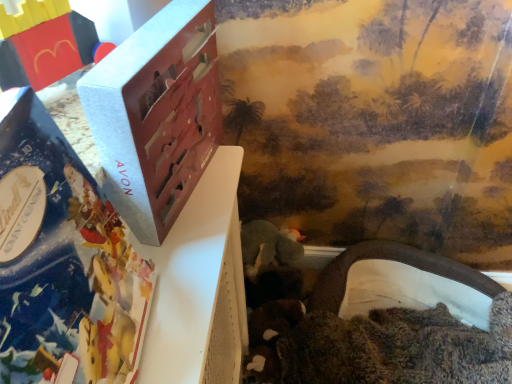
Question: Can you confirm if matte silver book at left is positioned to the left of white fabric tunnel at lower right, arranged as the 1th toy when ordered from the bottom?

Choices:
 (A) yes
 (B) no

Answer: (A)

Question: Considering the relative sizes of matte silver book at left and white fabric tunnel at lower right, arranged as the 1th toy when ordered from the bottom, in the image provided, is matte silver book at left bigger than white fabric tunnel at lower right, arranged as the 1th toy when ordered from the bottom,?

Choices:
 (A) yes
 (B) no

Answer: (B)

Question: Is the depth of matte silver book at left less than that of white fabric tunnel at lower right, which is the first toy in right-to-left order?

Choices:
 (A) no
 (B) yes

Answer: (B)

Question: Is matte silver book at left wider than white fabric tunnel at lower right, which is the first toy in right-to-left order?

Choices:
 (A) yes
 (B) no

Answer: (B)

Question: Can you confirm if matte silver book at left is positioned to the right of white fabric tunnel at lower right, the second toy in the left-to-right sequence?

Choices:
 (A) yes
 (B) no

Answer: (B)

Question: Is matte silver book at left far away from white fabric tunnel at lower right, acting as the second toy starting from the front?

Choices:
 (A) yes
 (B) no

Answer: (A)

Question: Is matte silver book at left positioned in front of brick-like plastic toy at upper left, marked as the 1th toy in a left-to-right arrangement?

Choices:
 (A) yes
 (B) no

Answer: (A)

Question: From the image's perspective, is matte silver book at left beneath brick-like plastic toy at upper left, which appears as the first toy when viewed from the top?

Choices:
 (A) yes
 (B) no

Answer: (A)

Question: Is matte silver book at left facing away from brick-like plastic toy at upper left, marked as the 1th toy in a left-to-right arrangement?

Choices:
 (A) yes
 (B) no

Answer: (B)

Question: Does matte silver book at left come behind brick-like plastic toy at upper left, which is the 2th toy in right-to-left order?

Choices:
 (A) no
 (B) yes

Answer: (A)

Question: Is there a large distance between matte silver book at left and brick-like plastic toy at upper left, marked as the 1th toy in a left-to-right arrangement?

Choices:
 (A) yes
 (B) no

Answer: (B)

Question: From a real-world perspective, is matte silver book at left on top of brick-like plastic toy at upper left, arranged as the 2th toy when ordered from the bottom?

Choices:
 (A) yes
 (B) no

Answer: (B)

Question: Is the depth of brick-like plastic toy at upper left, positioned as the 2th toy in back-to-front order, greater than that of white fabric tunnel at lower right, arranged as the 1th toy when ordered from the bottom?

Choices:
 (A) no
 (B) yes

Answer: (A)